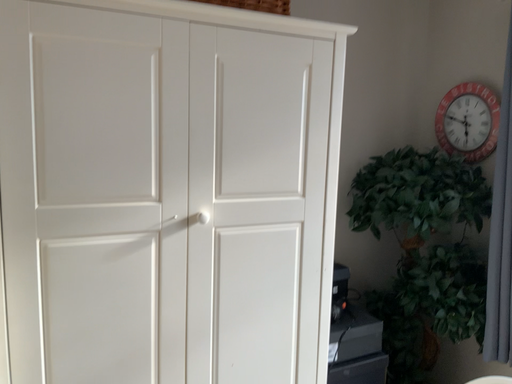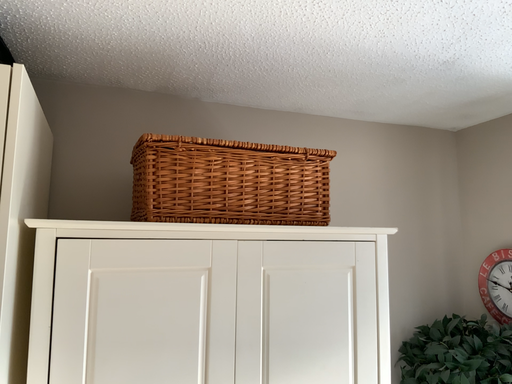
Question: Which way did the camera rotate in the video?

Choices:
 (A) rotated downward
 (B) rotated upward

Answer: (B)